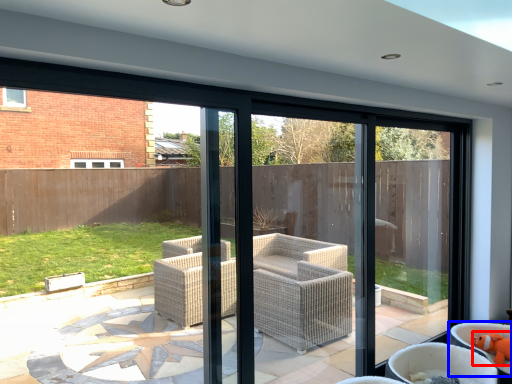
Question: Which of the following is the closest to the observer, toy (highlighted by a red box) or chair (highlighted by a blue box)?

Choices:
 (A) toy
 (B) chair

Answer: (B)